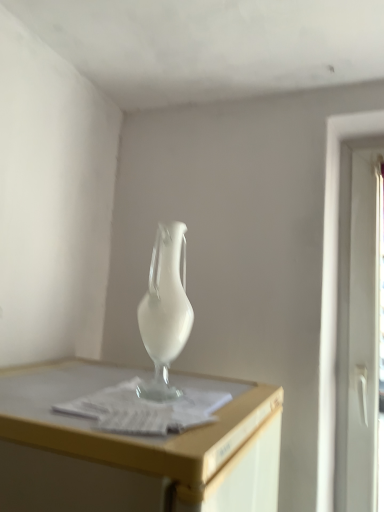
Question: Can you confirm if white plastic screen door at right is taller than white paper at center?

Choices:
 (A) no
 (B) yes

Answer: (B)

Question: Can you confirm if white plastic screen door at right is positioned to the right of white paper at center?

Choices:
 (A) no
 (B) yes

Answer: (B)

Question: Is white plastic screen door at right oriented away from white paper at center?

Choices:
 (A) yes
 (B) no

Answer: (B)

Question: Considering the relative sizes of white plastic screen door at right and white paper at center in the image provided, is white plastic screen door at right thinner than white paper at center?

Choices:
 (A) yes
 (B) no

Answer: (A)

Question: Can you confirm if white plastic screen door at right is positioned to the left of white paper at center?

Choices:
 (A) no
 (B) yes

Answer: (A)

Question: Relative to white plastic screen door at right, is satin white vase at center in front or behind?

Choices:
 (A) front
 (B) behind

Answer: (A)

Question: Considering the positions of satin white vase at center and white plastic screen door at right in the image, is satin white vase at center taller or shorter than white plastic screen door at right?

Choices:
 (A) short
 (B) tall

Answer: (A)

Question: Is point (147, 290) positioned closer to the camera than point (365, 303)?

Choices:
 (A) farther
 (B) closer

Answer: (B)

Question: From a real-world perspective, relative to white plastic screen door at right, is satin white vase at center vertically above or below?

Choices:
 (A) above
 (B) below

Answer: (A)

Question: From the image's perspective, is white paper at center located above or below white plastic screen door at right?

Choices:
 (A) above
 (B) below

Answer: (B)

Question: From a real-world perspective, relative to white plastic screen door at right, is white paper at center vertically above or below?

Choices:
 (A) above
 (B) below

Answer: (B)

Question: Based on their positions, is white paper at center located to the left or right of white plastic screen door at right?

Choices:
 (A) left
 (B) right

Answer: (A)

Question: Relative to white plastic screen door at right, is white paper at center in front or behind?

Choices:
 (A) front
 (B) behind

Answer: (A)

Question: From a real-world perspective, is white plastic screen door at right above or below satin white vase at center?

Choices:
 (A) above
 (B) below

Answer: (B)

Question: In the image, is white plastic screen door at right positioned in front of or behind satin white vase at center?

Choices:
 (A) front
 (B) behind

Answer: (B)